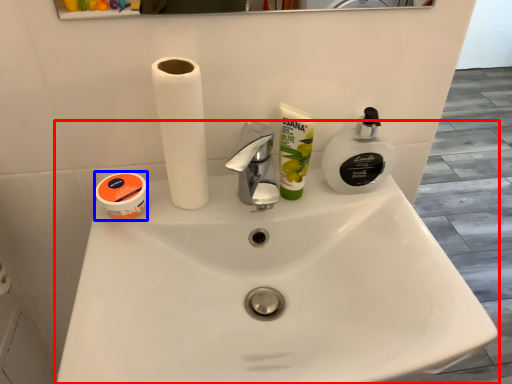
Question: Which point is closer to the camera, sink (highlighted by a red box) or toiletry (highlighted by a blue box)?

Choices:
 (A) sink
 (B) toiletry

Answer: (A)